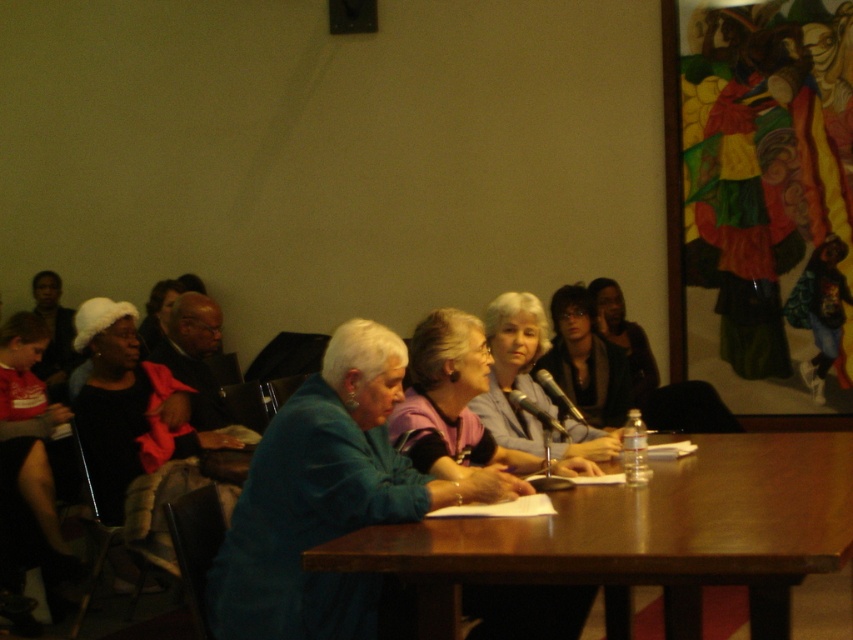
Question: Which object is the closest to the blue fabric jacket at center?

Choices:
 (A) smooth gray sweater at center
 (B) matte black jacket at center

Answer: (A)

Question: Which object is closer to the camera taking this photo?

Choices:
 (A) blue fabric jacket at center
 (B) brown wood table at center
 (C) matte black jacket at center
 (D) smooth gray sweater at center

Answer: (B)

Question: Is blue fabric jacket at center thinner than smooth gray sweater at center?

Choices:
 (A) yes
 (B) no

Answer: (B)

Question: Does blue fabric jacket at center have a lesser width compared to smooth gray sweater at center?

Choices:
 (A) yes
 (B) no

Answer: (B)

Question: Among these objects, which one is nearest to the camera?

Choices:
 (A) smooth gray sweater at center
 (B) blue fabric jacket at center
 (C) brown wood table at center

Answer: (C)

Question: Does brown wood table at center have a lesser width compared to blue fabric jacket at center?

Choices:
 (A) yes
 (B) no

Answer: (B)